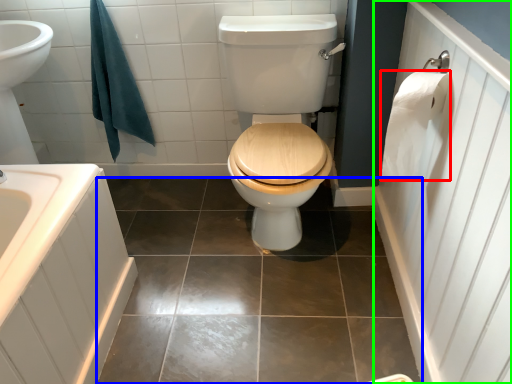
Question: Which object is positioned farthest from toilet paper (highlighted by a red box)? Select from ceramic tile (highlighted by a blue box) and side (highlighted by a green box).

Choices:
 (A) ceramic tile
 (B) side

Answer: (A)